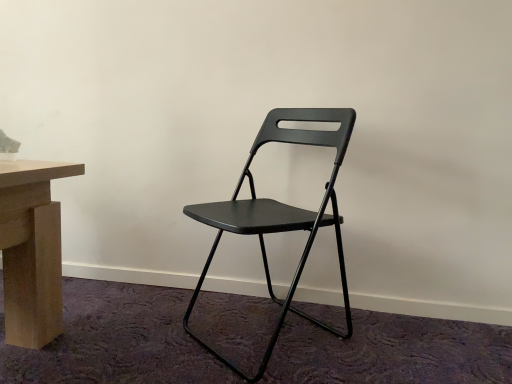
Find the location of a particular element. vacant location below matte black folding chair at center (from a real-world perspective) is located at coordinates (275, 339).